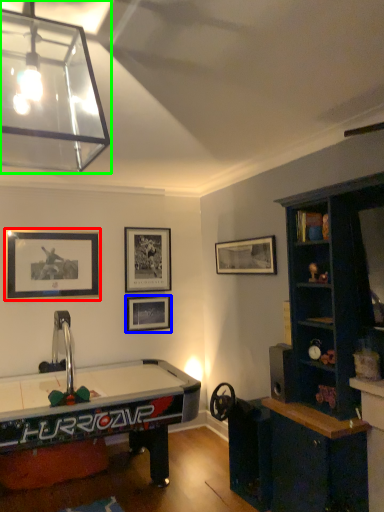
Question: Which is farther away from picture frame (highlighted by a red box)? picture frame (highlighted by a blue box) or lamp (highlighted by a green box)?

Choices:
 (A) picture frame
 (B) lamp

Answer: (B)